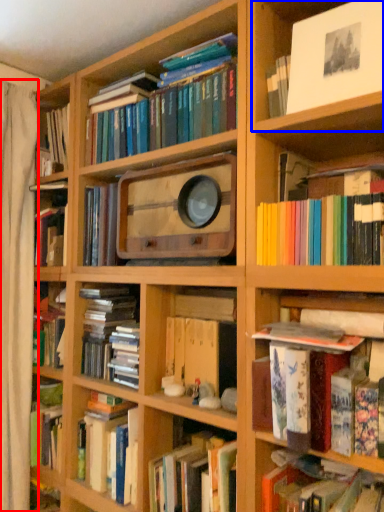
Question: Which point is closer to the camera, curtain (highlighted by a red box) or cabinet (highlighted by a blue box)?

Choices:
 (A) curtain
 (B) cabinet

Answer: (B)